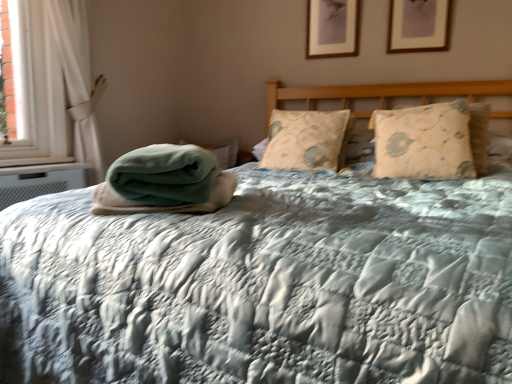
Question: Considering the positions of point (429, 23) and point (131, 200), is point (429, 23) closer or farther from the camera than point (131, 200)?

Choices:
 (A) closer
 (B) farther

Answer: (B)

Question: In terms of size, does wooden picture frame at upper center, which is the 2th picture frame from back to front, appear bigger or smaller than green textured blanket at center?

Choices:
 (A) big
 (B) small

Answer: (B)

Question: Based on their relative distances, which object is nearer to the beige quilted pillow at right, the first pillow positioned from the right?

Choices:
 (A) beige floral pillow at center, the second pillow from the right
 (B) wooden picture frame at upper center, marked as the 1th picture frame in a front-to-back arrangement
 (C) green textured blanket at center
 (D) white fabric curtain at left
 (E) matte wooden picture frame at upper center, which is the 2th picture frame from front to back

Answer: (A)

Question: Estimate the real-world distances between objects in this image. Which object is farther from the wooden picture frame at upper center, which is the 2th picture frame from back to front?

Choices:
 (A) beige floral pillow at center, the second pillow from the right
 (B) matte wooden picture frame at upper center, the second picture frame viewed from the right
 (C) white fabric curtain at left
 (D) green textured blanket at center
 (E) beige quilted pillow at right, placed as the second pillow when sorted from left to right

Answer: (C)